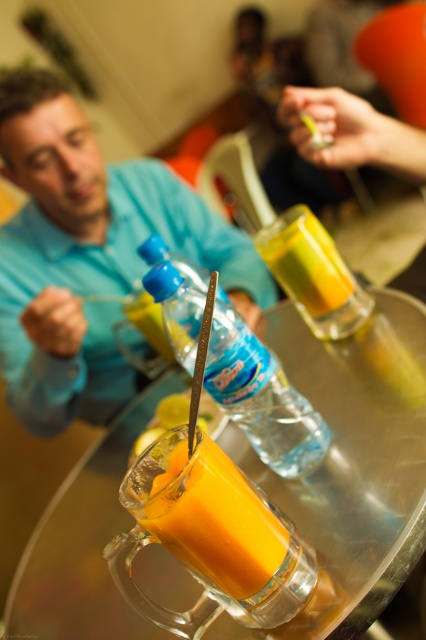
Is blue matte shirt at upper left behind translucent glass mug at center?

Yes.

Consider the image. Can you confirm if blue matte shirt at upper left is wider than translucent glass mug at center?

Indeed, blue matte shirt at upper left has a greater width compared to translucent glass mug at center.

I want to click on blue matte shirt at upper left, so tap(89, 253).

Based on the photo, does transparent glass table at center have a greater height compared to translucent glass mug at center?

Yes.

Does point (362, 627) lie in front of point (170, 472)?

Yes, point (362, 627) is closer to viewer.

Where is `transparent glass table at center`? transparent glass table at center is located at coordinates (356, 451).

Where is `transparent glass table at center`? The height and width of the screenshot is (640, 426). transparent glass table at center is located at coordinates point(356,451).

Is point (29, 192) positioned behind point (238, 397)?

Yes, it is behind point (238, 397).

Which of these two, blue matte shirt at upper left or transparent plastic bottle at center, stands taller?

With more height is blue matte shirt at upper left.

At what (x,y) coordinates should I click in order to perform the action: click on blue matte shirt at upper left. Please return your answer as a coordinate pair (x, y). Looking at the image, I should click on (89, 253).